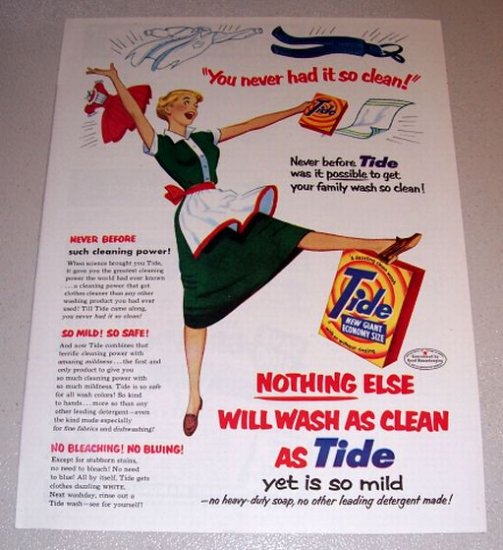
The height and width of the screenshot is (550, 503). Identify the location of towel. (377, 114).